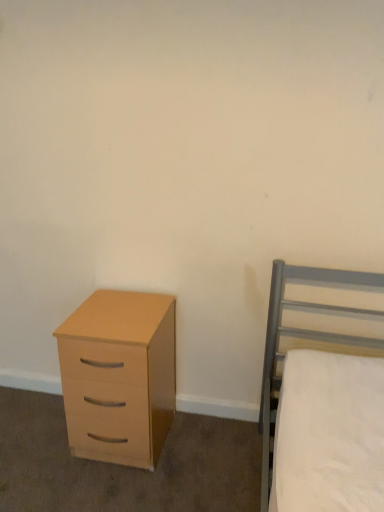
Where is `vacant area in front of light wood/veneer chest of drawers at lower left`? This screenshot has height=512, width=384. vacant area in front of light wood/veneer chest of drawers at lower left is located at coordinates (110, 489).